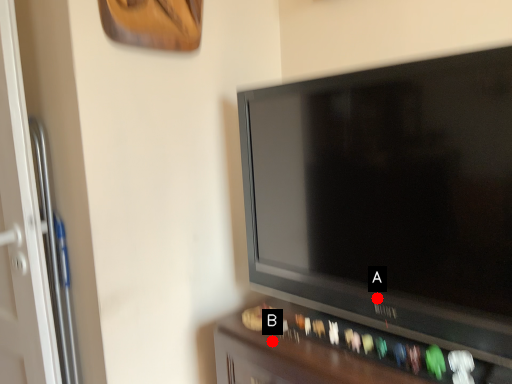
Question: Two points are circled on the image, labeled by A and B beside each circle. Which point is closer to the camera taking this photo?

Choices:
 (A) A is closer
 (B) B is closer

Answer: (A)